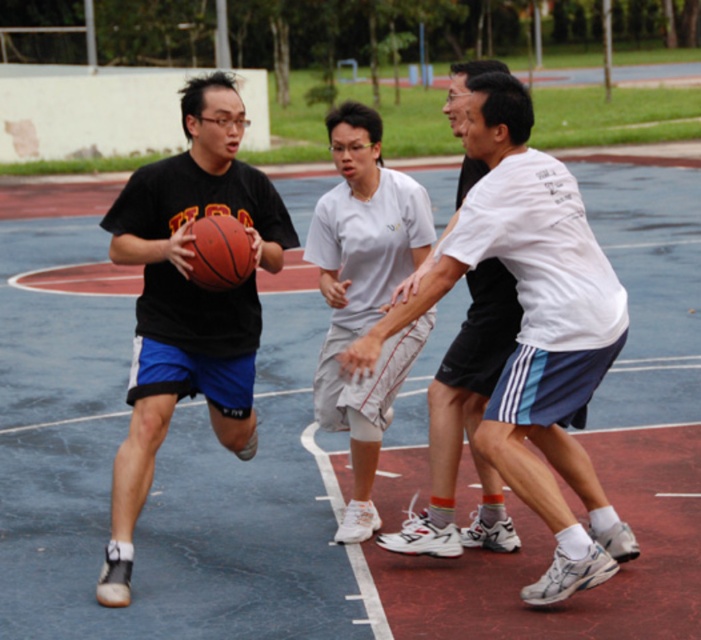
You are a referee standing at the edge of the court. You need to determine if the white cotton shirt at center and the rubber textured basketball at center are within the 3 feet distance rule for a legal play. Can you confirm?

The white cotton shirt at center and the rubber textured basketball at center are 36.08 inches apart from each other. Since 36.08 inches is equal to 3.0067 feet, which is just over 3 feet, the distance exceeds the 3 feet rule. Therefore, the play is illegal.

Consider the image. You are a referee observing the basketball game. You notice the rubber textured basketball at left and the white cotton shirt at center. Which object is positioned lower in the image?

The rubber textured basketball at left is positioned lower than the white cotton shirt at center.

You are a referee standing at the center of the court. You need to determine if the rubber textured basketball at left is within the court boundaries. The court boundaries are defined by the red lines. The court coordinates are from point 0.0 to 1.0 in both x and y axes. The basketball is at point 0.514, 0.753. The court boundaries are at x from 0.0 to 0.9 and y from 0.0 to 0.9. Is the basketball inside the court?

The rubber textured basketball at left is at point (526, 328). The court boundaries are from x 0.0 to 0.9 and y 0.0 to 0.9. Since both coordinates are within these ranges, the basketball is inside the court.